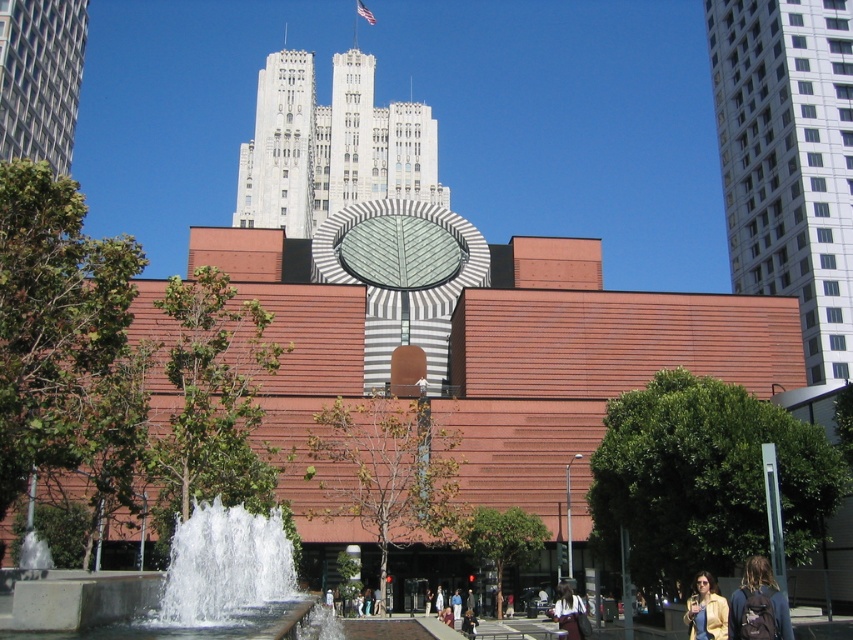
You are standing at the entrance of the building and want to take a photo of the white stone tower at upper center. According to the scene description, where should you position yourself to capture the tower in the center of your photo?

To capture the white stone tower at upper center in the center of your photo, you should position yourself directly in front of the building at the entrance, as the tower is located at the upper center point of the scene.

You are standing in front of the modern architectural structure and want to take a photo. There are two points marked in the image at coordinates point [276,625] and point [28,88]. Which point should you focus on to ensure it appears larger in your photo?

Point [276,625] is closer to the camera than point [28,88], so focusing on it will make it appear larger in the photo.

You are standing at the base of the building and looking up. There is a point marked at coordinates [329,145] on the building. What does this point indicate?

The point at coordinates [329,145] marks the location of the white stone tower at upper center on the building.